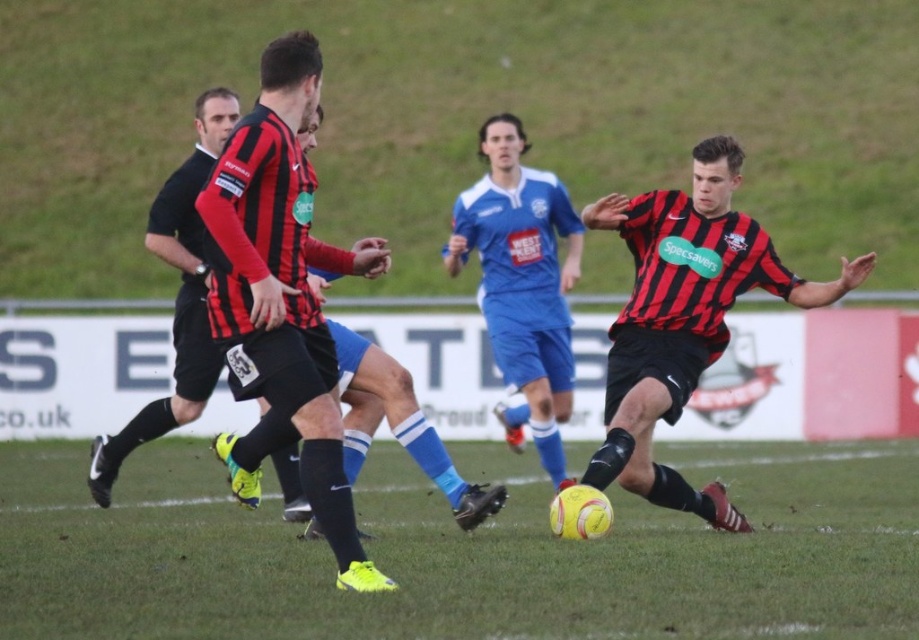
You are a soccer coach standing on the sideline and want to analyze the positioning of the players. There is a specific point marked at coordinates point (473, 632) that is crucial for the next play. If you need to place a cone exactly 5 meters away from this point towards the direction of the soccer ball, how far will the cone be from the soccer ball?

The distance of point (473, 632) from viewer is 7.30 meters. Placing a cone 5 meters away from this point towards the soccer ball would mean the cone is 7.30 meters minus 5 meters, resulting in a distance of 2.30 meters from the soccer ball.

You are a soccer referee observing the game. You need to determine if the yellow rubber ball at center is entirely visible above the matte black jersey at center. Based on the scene description, can you confirm this?

The yellow rubber ball at center is not as tall as matte black jersey at center, so the ball is partially hidden behind the jersey and not entirely visible above it.